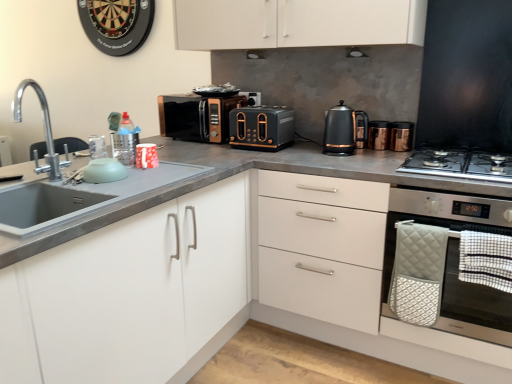
Question: Is stainless steel gas stove at right closer to camera compared to gold metallic canister at upper right, which ranks as the 3th appliance in back-to-front order?

Choices:
 (A) no
 (B) yes

Answer: (B)

Question: Considering the relative sizes of stainless steel gas stove at right and gold metallic canister at upper right, the fourth appliance when ordered from left to right, in the image provided, is stainless steel gas stove at right taller than gold metallic canister at upper right, the fourth appliance when ordered from left to right,?

Choices:
 (A) yes
 (B) no

Answer: (B)

Question: Considering the relative sizes of stainless steel gas stove at right and gold metallic canister at upper right, which ranks as the 3th appliance in back-to-front order, in the image provided, is stainless steel gas stove at right smaller than gold metallic canister at upper right, which ranks as the 3th appliance in back-to-front order,?

Choices:
 (A) yes
 (B) no

Answer: (B)

Question: Is stainless steel gas stove at right facing away from gold metallic canister at upper right, which is counted as the third appliance, starting from the top?

Choices:
 (A) yes
 (B) no

Answer: (B)

Question: Is stainless steel gas stove at right placed right next to gold metallic canister at upper right, which is counted as the third appliance, starting from the top?

Choices:
 (A) yes
 (B) no

Answer: (B)

Question: Does stainless steel gas stove at right have a greater width compared to gold metallic canister at upper right, which ranks as the 3th appliance in back-to-front order?

Choices:
 (A) yes
 (B) no

Answer: (A)

Question: From the image's perspective, is black matte exhaust hood at upper center, acting as the second exhaust hood starting from the front, below black matte exhaust hood at upper center, the first exhaust hood viewed from the right?

Choices:
 (A) yes
 (B) no

Answer: (B)

Question: Is the depth of black matte exhaust hood at upper center, the 2th exhaust hood in the right-to-left sequence, less than that of black matte exhaust hood at upper center, which is the first exhaust hood in front-to-back order?

Choices:
 (A) no
 (B) yes

Answer: (A)

Question: Is black matte exhaust hood at upper center, marked as the first exhaust hood in a left-to-right arrangement, next to black matte exhaust hood at upper center, which appears as the 2th exhaust hood when viewed from the left?

Choices:
 (A) no
 (B) yes

Answer: (A)

Question: Is the position of black matte exhaust hood at upper center, which is the 1th exhaust hood in back-to-front order, more distant than that of black matte exhaust hood at upper center, the first exhaust hood viewed from the right?

Choices:
 (A) yes
 (B) no

Answer: (A)

Question: Does black matte exhaust hood at upper center, the 2th exhaust hood in the right-to-left sequence, have a lesser height compared to black matte exhaust hood at upper center, the first exhaust hood viewed from the right?

Choices:
 (A) no
 (B) yes

Answer: (B)

Question: Can you confirm if black matte exhaust hood at upper center, which is the 1th exhaust hood in back-to-front order, is taller than black matte exhaust hood at upper center, acting as the second exhaust hood starting from the back?

Choices:
 (A) yes
 (B) no

Answer: (B)

Question: Can you confirm if chrome metallic faucet at left is positioned to the left of white matte cabinet at center, marked as the first cabinetry in a right-to-left arrangement?

Choices:
 (A) no
 (B) yes

Answer: (B)